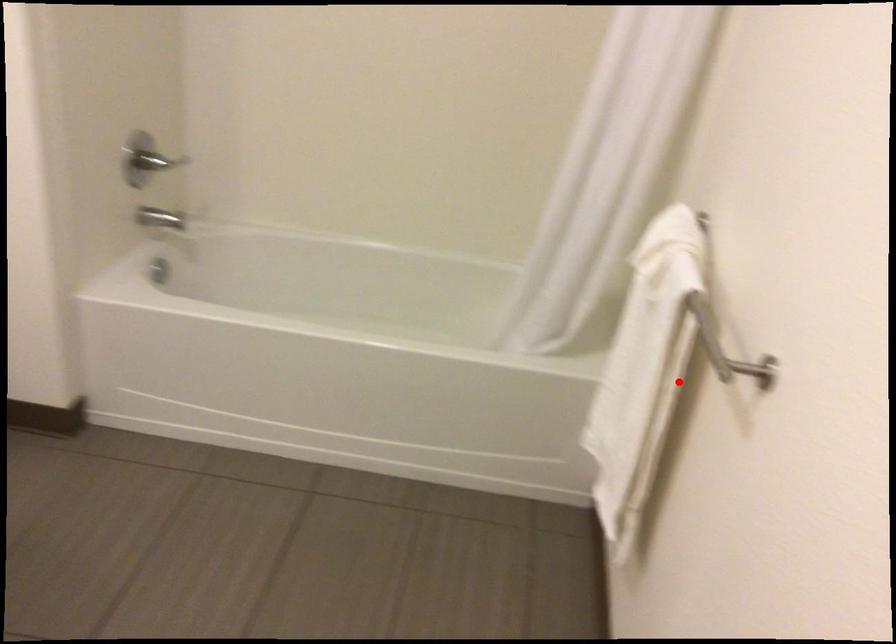
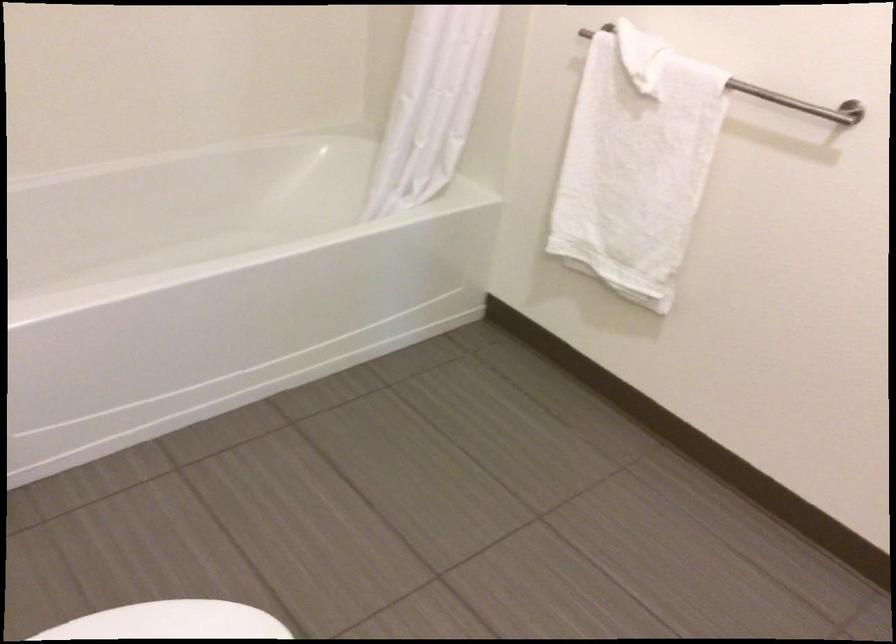
Question: I am providing you with two images of the same scene from different viewpoints. Image1 has a red point marked. In image2, the corresponding 3D location appears at what relative position? Reply with the corresponding letter.

Choices:
 (A) Closer
 (B) Farther

Answer: (B)